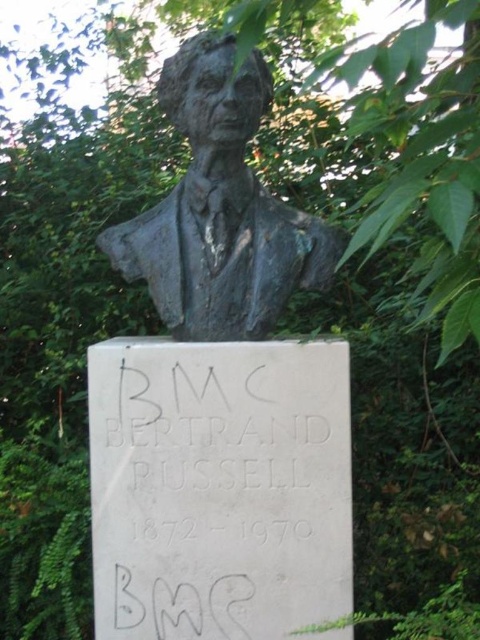
Which is in front, point (192, 467) or point (265, 321)?

Positioned in front is point (192, 467).

Does point (180, 355) come closer to viewer compared to point (204, 289)?

Yes, point (180, 355) is closer to viewer.

Locate an element on the screen. The image size is (480, 640). white stone plaque at center is located at coordinates (218, 486).